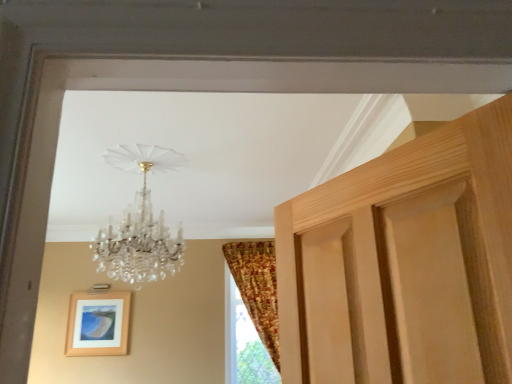
Question: Is wooden picture frame at lower left positioned with its back to crystal glass chandelier at upper center?

Choices:
 (A) no
 (B) yes

Answer: (A)

Question: Does wooden picture frame at lower left have a lesser height compared to crystal glass chandelier at upper center?

Choices:
 (A) yes
 (B) no

Answer: (A)

Question: Considering the relative sizes of wooden picture frame at lower left and crystal glass chandelier at upper center in the image provided, is wooden picture frame at lower left bigger than crystal glass chandelier at upper center?

Choices:
 (A) no
 (B) yes

Answer: (A)

Question: Would you say wooden picture frame at lower left is a long distance from crystal glass chandelier at upper center?

Choices:
 (A) no
 (B) yes

Answer: (B)

Question: Considering the relative sizes of wooden picture frame at lower left and crystal glass chandelier at upper center in the image provided, is wooden picture frame at lower left thinner than crystal glass chandelier at upper center?

Choices:
 (A) yes
 (B) no

Answer: (A)

Question: In the image, is wooden picture frame at lower left positioned in front of or behind crystal glass chandelier at upper center?

Choices:
 (A) front
 (B) behind

Answer: (B)

Question: Is wooden picture frame at lower left bigger or smaller than crystal glass chandelier at upper center?

Choices:
 (A) small
 (B) big

Answer: (A)

Question: Visually, is wooden picture frame at lower left positioned to the left or to the right of crystal glass chandelier at upper center?

Choices:
 (A) right
 (B) left

Answer: (B)

Question: From their relative heights in the image, would you say wooden picture frame at lower left is taller or shorter than crystal glass chandelier at upper center?

Choices:
 (A) short
 (B) tall

Answer: (A)

Question: From a real-world perspective, is wooden picture frame at lower left physically located above or below patterned fabric curtain at right?

Choices:
 (A) above
 (B) below

Answer: (B)

Question: From the image's perspective, is wooden picture frame at lower left located above or below patterned fabric curtain at right?

Choices:
 (A) above
 (B) below

Answer: (B)

Question: Is wooden picture frame at lower left taller or shorter than patterned fabric curtain at right?

Choices:
 (A) short
 (B) tall

Answer: (A)

Question: Considering the positions of wooden picture frame at lower left and patterned fabric curtain at right in the image, is wooden picture frame at lower left wider or thinner than patterned fabric curtain at right?

Choices:
 (A) thin
 (B) wide

Answer: (A)

Question: From a real-world perspective, is crystal glass chandelier at upper center positioned above or below patterned fabric curtain at right?

Choices:
 (A) below
 (B) above

Answer: (B)

Question: Considering the positions of crystal glass chandelier at upper center and patterned fabric curtain at right in the image, is crystal glass chandelier at upper center taller or shorter than patterned fabric curtain at right?

Choices:
 (A) short
 (B) tall

Answer: (A)